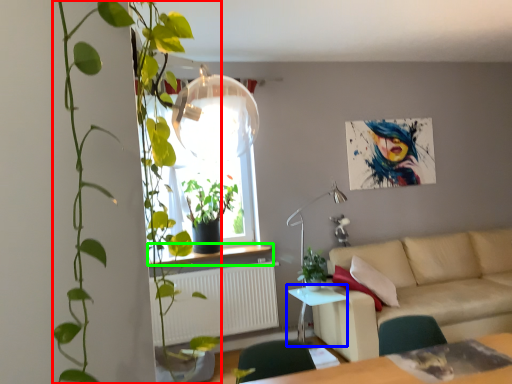
Question: Which object is the closest to the houseplant (highlighted by a red box)? Choose among these: table (highlighted by a blue box) or window sill (highlighted by a green box).

Choices:
 (A) table
 (B) window sill

Answer: (B)